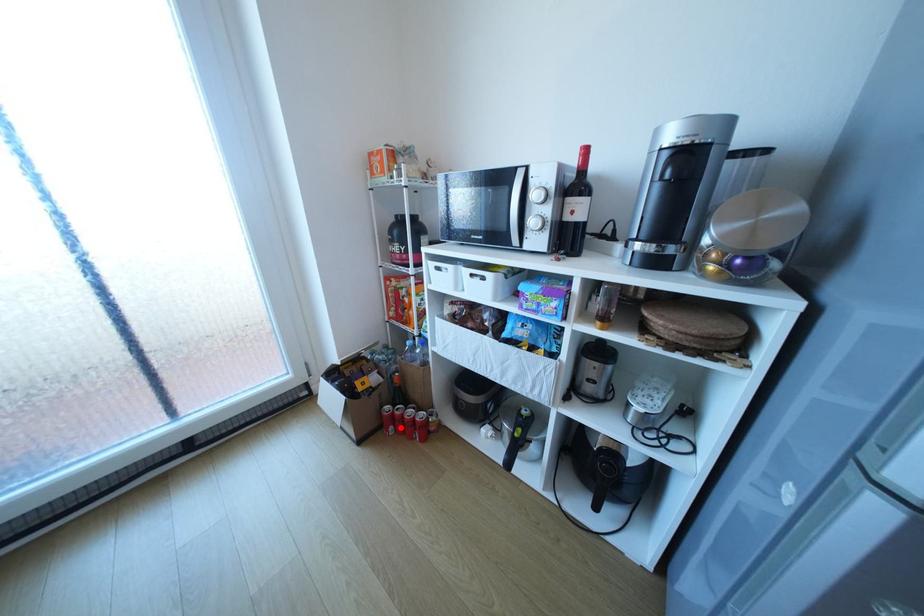
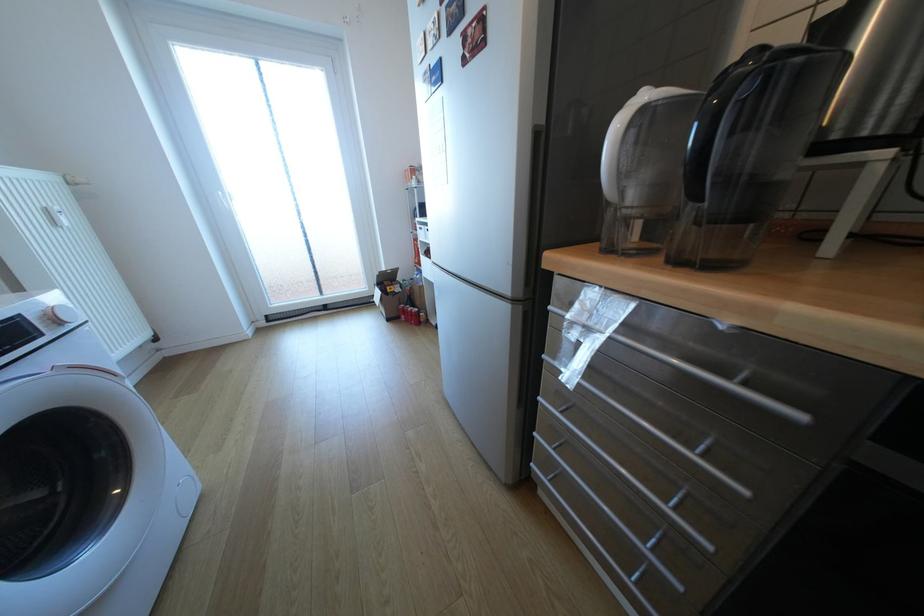
In the second image, find the point that corresponds to the highlighted location in the first image.

(411, 315)